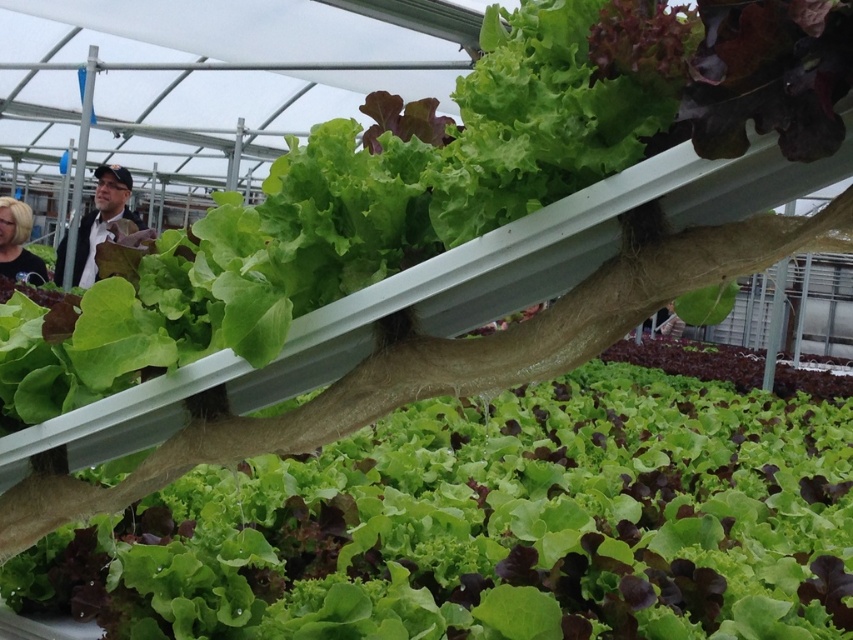
You are a drone operator trying to navigate a small drone between two points in the hydroponic lettuce greenhouse. The first point is point (112, 186) and the second point is point (671, 308). Given that the drone has a wingspan of 0.3 meters, can the drone safely pass through the space between these two points?

The point (112, 186) is further to the viewer than point (671, 308). Since the drone has a wingspan of 0.3 meters, it can safely navigate between these two points as long as the distance between them is sufficient. However, without specific distance information, we cannot confirm the exact feasibility. The description only provides their relative depth, not their separation in space.

You are a drone operator trying to capture aerial footage of the hydroponic lettuce setup. You need to determine the best angle to ensure both the lettuce plants and the two individuals in the background are clearly visible. Given the positions of point A at point (3, 216) and point B at point (679, 323), which point should you position your drone closer to for optimal visibility of both subjects?

Point A at point (3, 216) is closer to the camera than point B at point (679, 323). Positioning the drone closer to point A would allow better visibility of both the lettuce plants and the individuals in the background since it is nearer to the camera perspective.